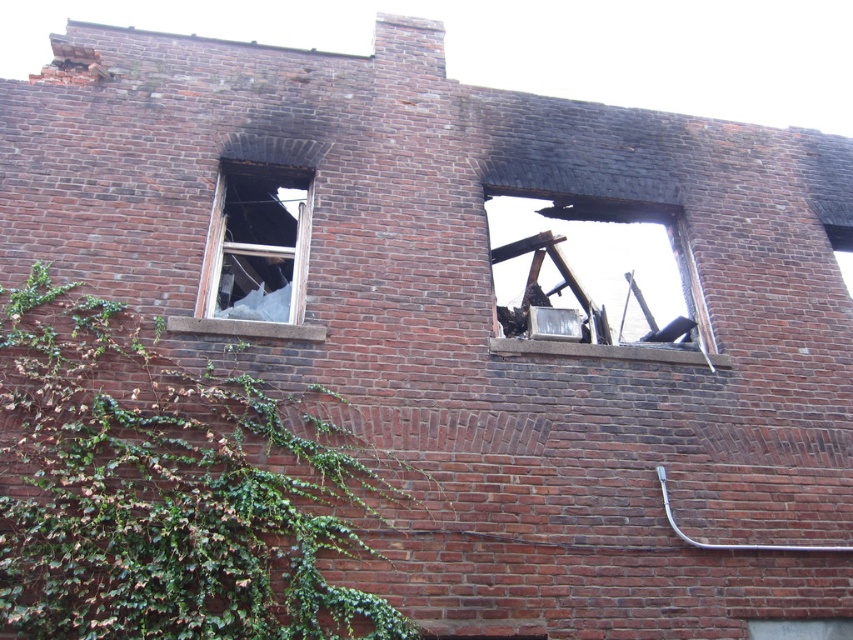
Question: Can you confirm if green leafy ivy at left is wider than charcoal wood debris at upper center?

Choices:
 (A) no
 (B) yes

Answer: (B)

Question: Which object is closer to the camera taking this photo?

Choices:
 (A) transparent glass window at upper left
 (B) charcoal wood debris at upper center

Answer: (A)

Question: Which point is closer to the camera?

Choices:
 (A) transparent glass window at upper left
 (B) charcoal wood debris at upper center

Answer: (A)

Question: Which point is closer to the camera?

Choices:
 (A) (498, 189)
 (B) (299, 173)

Answer: (B)

Question: In this image, where is charcoal wood debris at upper center located relative to transparent glass window at upper left?

Choices:
 (A) below
 (B) above

Answer: (A)

Question: Is green leafy ivy at left positioned at the back of charcoal wood debris at upper center?

Choices:
 (A) yes
 (B) no

Answer: (B)